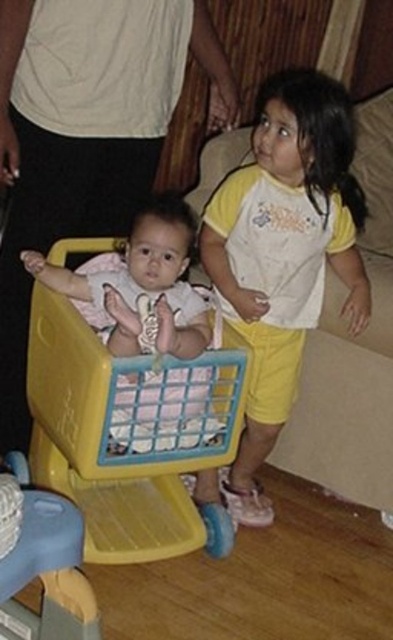
You are a photographer trying to capture a photo of the two children in the scene. You notice two specific points marked at coordinates point [310,253] and point [141,384]. Which point should you focus on to ensure the child on the right is in the foreground?

Point [141,384] should be focused on because it is in front of point [310,253], ensuring the child on the right is closer to the camera and in the foreground.

You are a parent trying to organize your childen clothes. You have a drawer that can only fit items that are 10 cm thick. You see the yellow cotton shorts at center and the yellow plastic shopping cart at center. Which item can fit into the drawer?

The yellow cotton shorts at center is thinner than the yellow plastic shopping cart at center, so the yellow cotton shorts at center can fit into the drawer since it is thinner than 10 cm.